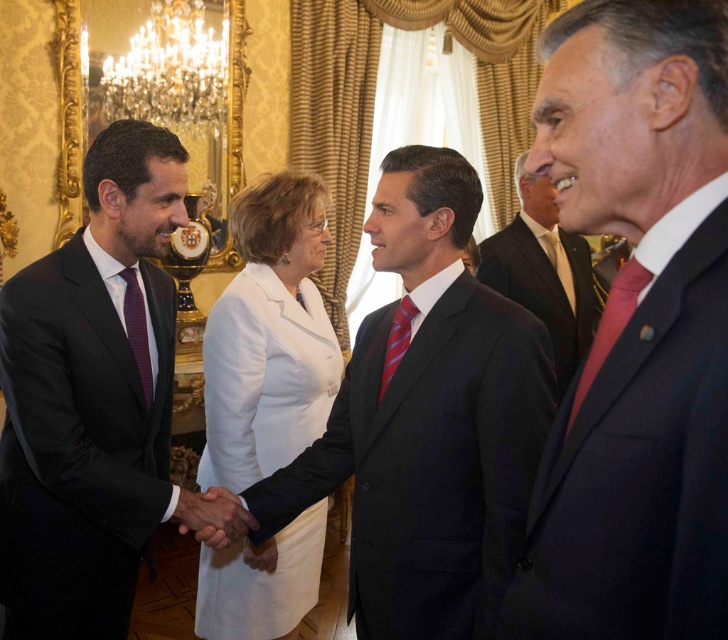
Question: Among these objects, which one is farthest from the camera?

Choices:
 (A) dark suit at left
 (B) dark suit at right

Answer: (B)

Question: Does smooth skin handshake at center have a lesser width compared to striped silk tie at center?

Choices:
 (A) no
 (B) yes

Answer: (A)

Question: Can you confirm if dark suit at left is positioned below smooth skin handshake at center?

Choices:
 (A) yes
 (B) no

Answer: (B)

Question: Which object appears farthest from the camera in this image?

Choices:
 (A) red satin tie at right
 (B) dark blue suit at center
 (C) black smooth suit at center
 (D) dark suit at left

Answer: (D)

Question: Which of the following is the closest to the observer?

Choices:
 (A) (261, 211)
 (B) (146, 321)

Answer: (B)

Question: Is dark blue suit at center in front of striped silk tie at center?

Choices:
 (A) no
 (B) yes

Answer: (B)